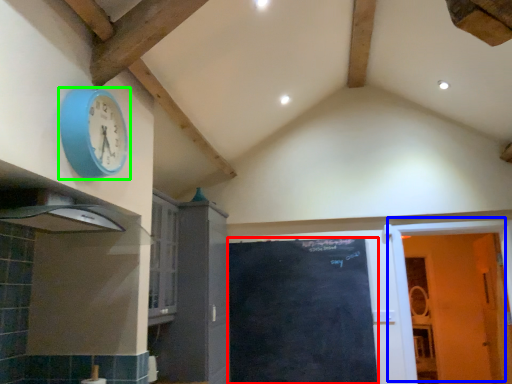
Question: Based on their relative distances, which object is farther from door (highlighted by a red box)? Choose from door (highlighted by a blue box) and wall clock (highlighted by a green box).

Choices:
 (A) door
 (B) wall clock

Answer: (B)